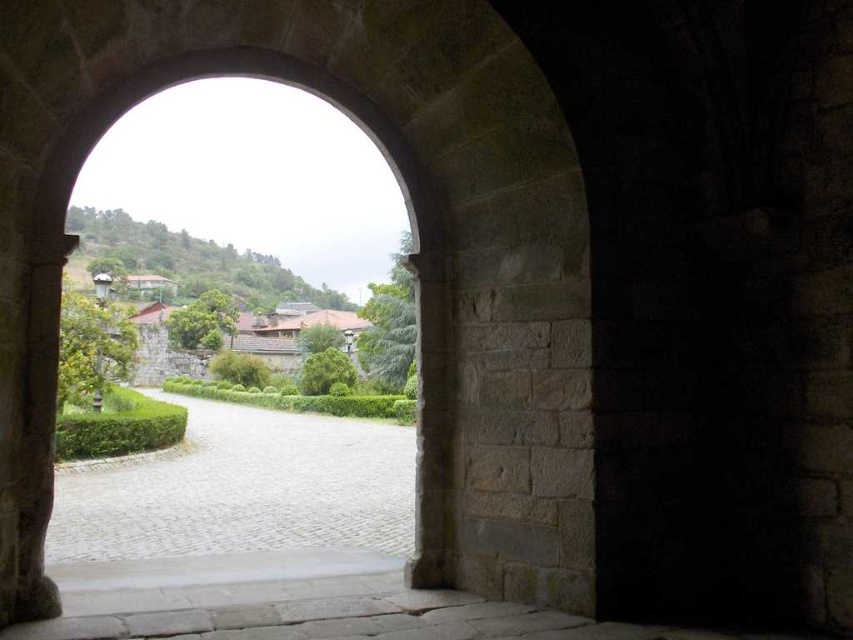
Question: Is paved stone path at center smaller than stone archway at center?

Choices:
 (A) yes
 (B) no

Answer: (B)

Question: From the image, what is the correct spatial relationship of paved stone path at center in relation to stone archway at center?

Choices:
 (A) below
 (B) above

Answer: (A)

Question: Observing the image, what is the correct spatial positioning of paved stone path at center in reference to stone archway at center?

Choices:
 (A) below
 (B) above

Answer: (A)

Question: Which point is closer to the camera taking this photo?

Choices:
 (A) (425, 292)
 (B) (99, 554)

Answer: (A)

Question: Which point is closer to the camera?

Choices:
 (A) paved stone path at center
 (B) stone archway at center

Answer: (A)

Question: Which point is closer to the camera?

Choices:
 (A) paved stone path at center
 (B) stone archway at center

Answer: (A)